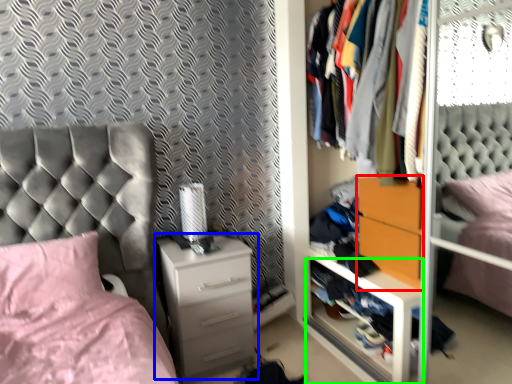
Question: Which is farther away from nightstand (highlighted by a red box)? chest of drawers (highlighted by a blue box) or shelf (highlighted by a green box)?

Choices:
 (A) chest of drawers
 (B) shelf

Answer: (A)